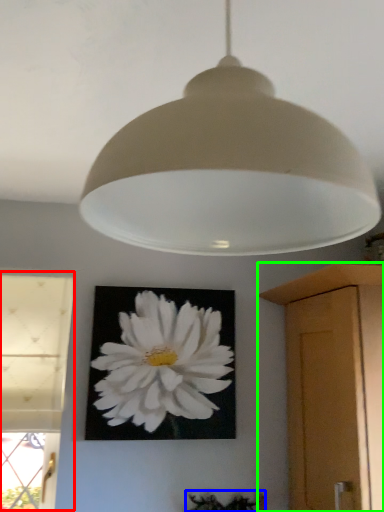
Question: Which object is the farthest from window (highlighted by a red box)? Choose among these: plant (highlighted by a blue box) or cabinetry (highlighted by a green box).

Choices:
 (A) plant
 (B) cabinetry

Answer: (B)